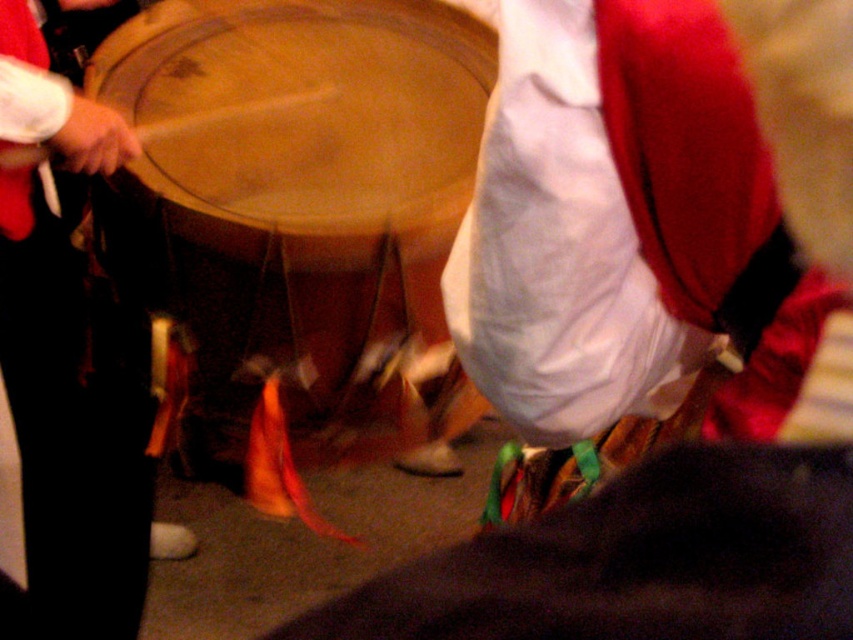
You are a stagehand setting up for a performance. You have two drums in front of you, the wooden drum at center and the matte black drum at center. The performance requires the larger drum to be placed on the left side of the stage. Which drum should you place on the left?

The wooden drum at center is larger than the matte black drum at center, so you should place the wooden drum at center on the left side of the stage.

You are standing in front of the wooden drum at center and want to place a 1 meter long decorative cloth on it. Can the cloth fit entirely on the drum?

The wooden drum at center is 1.03 meters from viewer, so the 1 meter long decorative cloth can fit entirely on it since it is slightly shorter than the distance to the drum.

You are a photographer trying to capture the drummer in action. You notice a specific point at coordinates (309, 212). Where exactly is this point located on the drum?

The point at coordinates (309, 212) is located on the wooden drum at center.